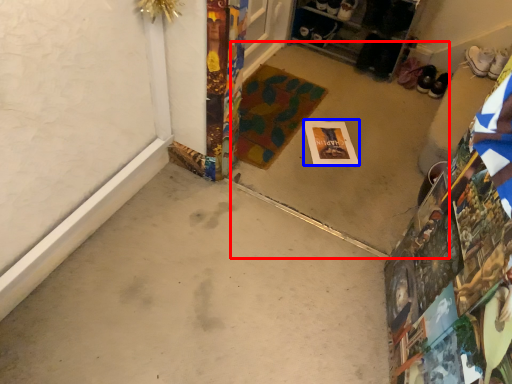
Question: Which object appears farthest to the camera in this image, concrete (highlighted by a red box) or postcard (highlighted by a blue box)?

Choices:
 (A) concrete
 (B) postcard

Answer: (B)